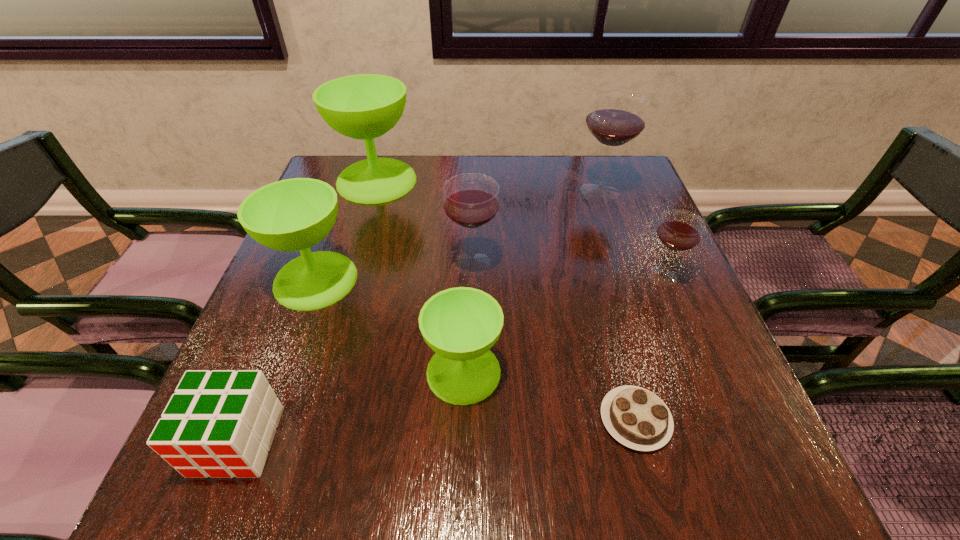
Locate which object is the closest to the leftmost red wineglass. Please provide its 2D coordinates. Your answer should be formatted as a tuple, i.e. [(x, y)], where the tuple contains the x and y coordinates of a point satisfying the conditions above.

[(461, 324)]

This screenshot has width=960, height=540. Find the location of `object that is the closest to the smallest red wineglass`. object that is the closest to the smallest red wineglass is located at coordinates (616, 117).

This screenshot has height=540, width=960. In order to click on the third closest wineglass to the smallest red wineglass in this screenshot , I will do `click(461, 324)`.

Identify which wineglass is located as the fourth nearest to the chocolate cake. Please provide its 2D coordinates. Your answer should be formatted as a tuple, i.e. [(x, y)], where the tuple contains the x and y coordinates of a point satisfying the conditions above.

[(295, 214)]

Identify which red wineglass is the second closest to the chocolate cake. Please provide its 2D coordinates. Your answer should be formatted as a tuple, i.e. [(x, y)], where the tuple contains the x and y coordinates of a point satisfying the conditions above.

[(471, 201)]

Identify which red wineglass is located as the nearest to the farthest red wineglass. Please provide its 2D coordinates. Your answer should be formatted as a tuple, i.e. [(x, y)], where the tuple contains the x and y coordinates of a point satisfying the conditions above.

[(680, 230)]

At what (x,y) coordinates should I click in order to perform the action: click on green wineglass object that ranks as the closest to the second biggest green wineglass. Please return your answer as a coordinate pair (x, y). This screenshot has height=540, width=960. Looking at the image, I should click on (461, 324).

You are a GUI agent. You are given a task and a screenshot of the screen. Output one action in this format:
    pyautogui.click(x=<x>, y=<y>)
    Task: Click on the green wineglass that can be found as the closest to the biggest green wineglass
    This screenshot has height=540, width=960.
    Given the screenshot: What is the action you would take?
    pyautogui.click(x=295, y=214)

Locate an element on the screen. This screenshot has height=540, width=960. vacant space that satisfies the following two spatial constraints: 1. on the back side of the smallest red wineglass; 2. on the right side of the chocolate cake is located at coordinates (597, 276).